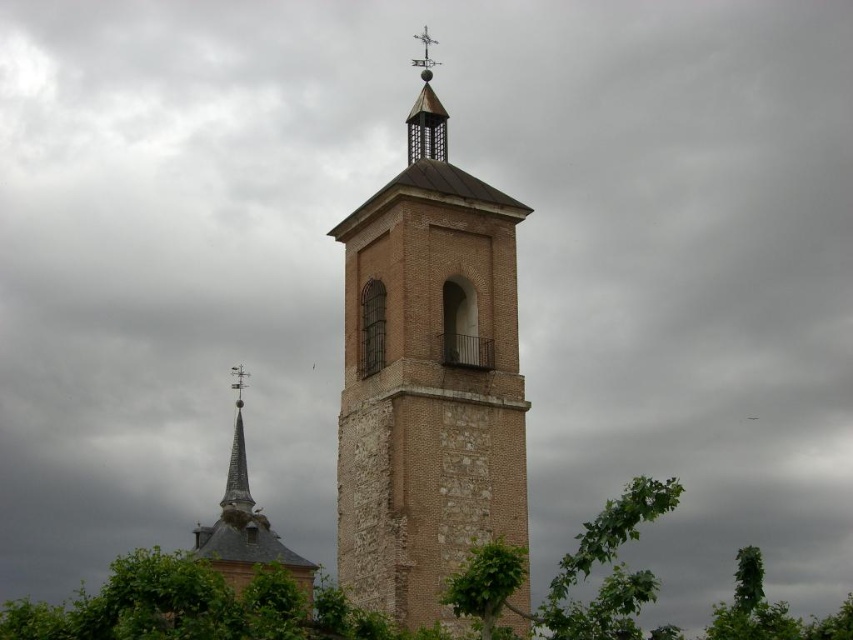
You are standing in front of the two structures and want to take a photo that includes both the smooth brick steeple at center and the smooth gray spire at center. Which structure should you position closer to the camera to ensure both are in frame?

You should position the smooth brick steeple at center closer to the camera since it is already closer to the viewer than the smooth gray spire at center, ensuring both are in frame.

You are standing in front of the bell tower and want to determine the relative positions of two points marked in the scene. Which point is closer to you, point (230, 566) or point (236, 486)?

Point (230, 566) is closer to the viewer than point (236, 486).